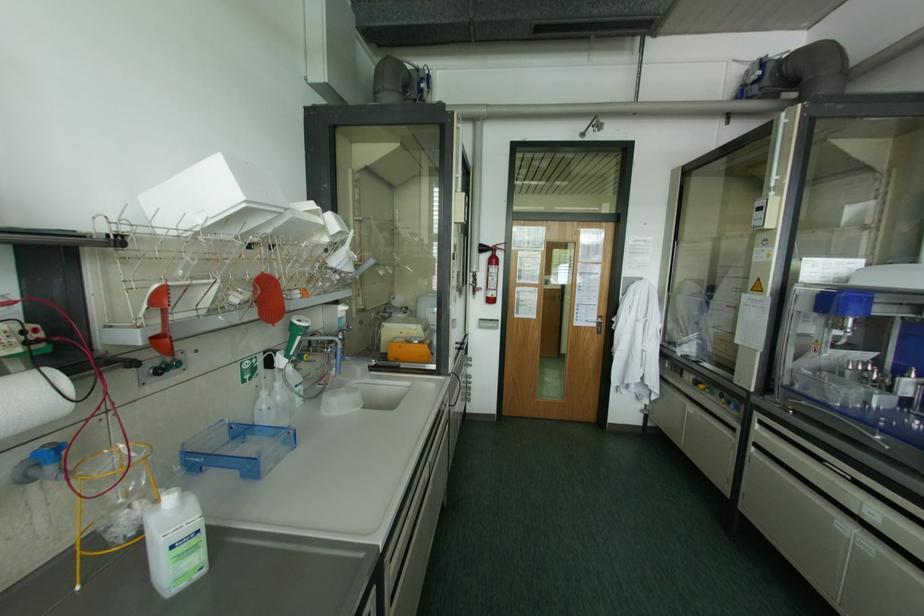
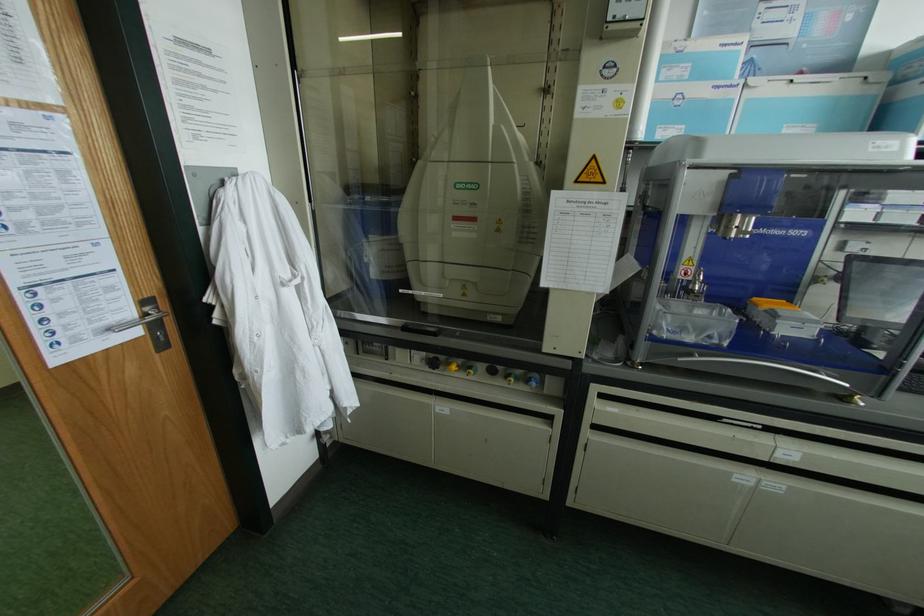
Find the pixel in the second image that matches point (874, 512) in the first image.

(789, 451)